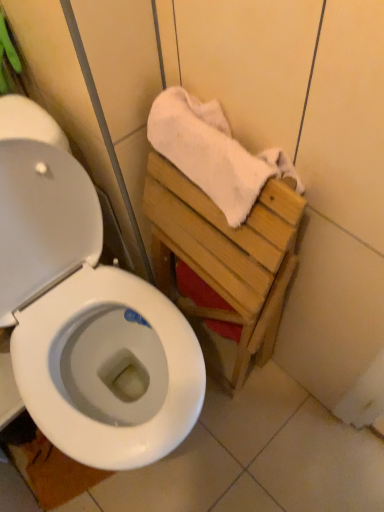
Question: In terms of size, does white glossy toilet seat at lower left appear bigger or smaller than white cotton towel at upper right?

Choices:
 (A) small
 (B) big

Answer: (A)

Question: Relative to white cotton towel at upper right, is white glossy toilet seat at lower left in front or behind?

Choices:
 (A) front
 (B) behind

Answer: (B)

Question: From their relative heights in the image, would you say white glossy toilet seat at lower left is taller or shorter than white cotton towel at upper right?

Choices:
 (A) short
 (B) tall

Answer: (A)

Question: Would you say white cotton towel at upper right is to the left or to the right of white glossy toilet seat at lower left in the picture?

Choices:
 (A) left
 (B) right

Answer: (B)

Question: Does point (196, 121) appear closer or farther from the camera than point (77, 470)?

Choices:
 (A) farther
 (B) closer

Answer: (B)

Question: Is white cotton towel at upper right inside the boundaries of white glossy toilet seat at lower left, or outside?

Choices:
 (A) inside
 (B) outside

Answer: (B)

Question: From the image's perspective, is white cotton towel at upper right above or below white glossy toilet seat at lower left?

Choices:
 (A) below
 (B) above

Answer: (B)